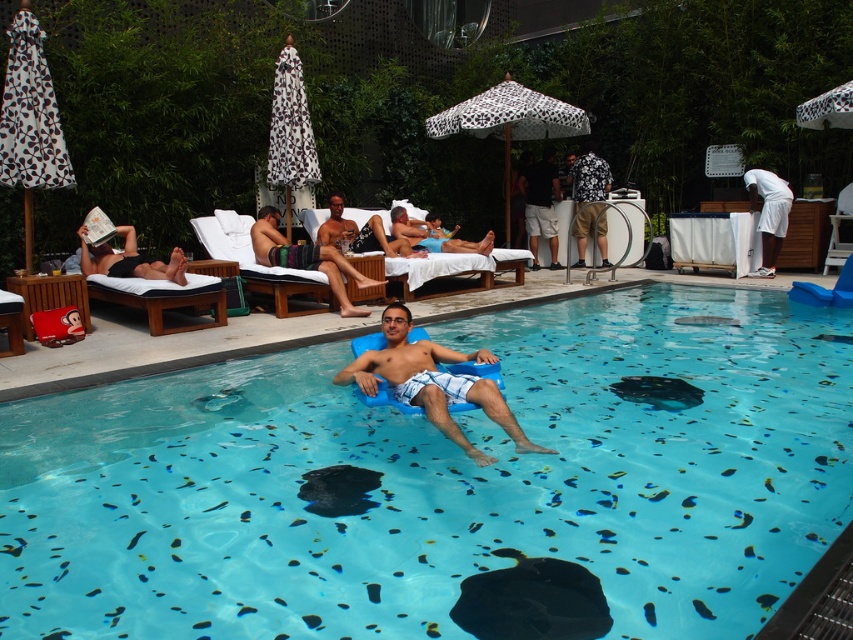
You are at the poolside and want to place both the black rubber stingray at center and the floral shirt at center on a small table. Based on their sizes, which item would you place first to ensure both fit comfortably?

The black rubber stingray at center occupies less space than the floral shirt at center, so you should place the floral shirt at center first to ensure both items fit comfortably on the small table.

Looking at this image, you are a guest at the resort and want to place your 1.5 meter tall luggage between the white printed fabric umbrella at upper center and the black fabric towel at upper left. Can it fit vertically between them?

The white printed fabric umbrella at upper center is taller than the black fabric towel at upper left. Since the luggage is 1.5 meters tall, it can be placed vertically between them as the height difference allows sufficient space.